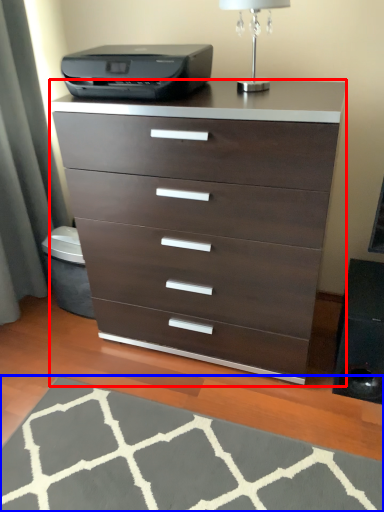
Question: Which object appears farthest to the camera in this image, chest of drawers (highlighted by a red box) or doormat (highlighted by a blue box)?

Choices:
 (A) chest of drawers
 (B) doormat

Answer: (A)